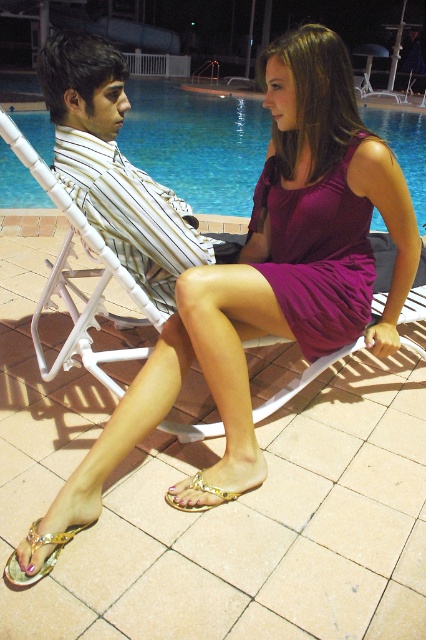
Which is more to the left, blue glass swimming pool at center or gold metallic sandal at lower center?

gold metallic sandal at lower center

Between point (227, 148) and point (187, 499), which one is positioned behind?

Point (227, 148)

Between point (135, 120) and point (184, 481), which one is positioned behind?

The point (135, 120) is more distant.

This screenshot has width=426, height=640. What are the coordinates of `blue glass swimming pool at center` in the screenshot? It's located at (196, 144).

Is point (362, 204) more distant than point (276, 401)?

No, (362, 204) is in front of (276, 401).

Who is lower down, purple satin dress at center or white striped fabric chair at center?

white striped fabric chair at center is below.

Who is more distant from viewer, (273, 280) or (98, 280)?

The point (98, 280) is more distant.

You are a GUI agent. You are given a task and a screenshot of the screen. Output one action in this format:
    pyautogui.click(x=<x>, y=<y>)
    Task: Click on the purple satin dress at center
    Image resolution: width=426 pixels, height=640 pixels.
    Given the screenshot: What is the action you would take?
    pyautogui.click(x=317, y=253)

Does purple satin dress at center appear under gold metallic sandal at lower center?

Incorrect, purple satin dress at center is not positioned below gold metallic sandal at lower center.

This screenshot has height=640, width=426. I want to click on purple satin dress at center, so click(317, 253).